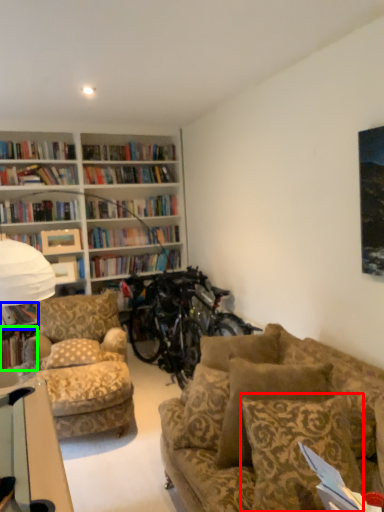
Question: Which is farther away from pillow (highlighted by a red box)? book (highlighted by a blue box) or book (highlighted by a green box)?

Choices:
 (A) book
 (B) book

Answer: (B)